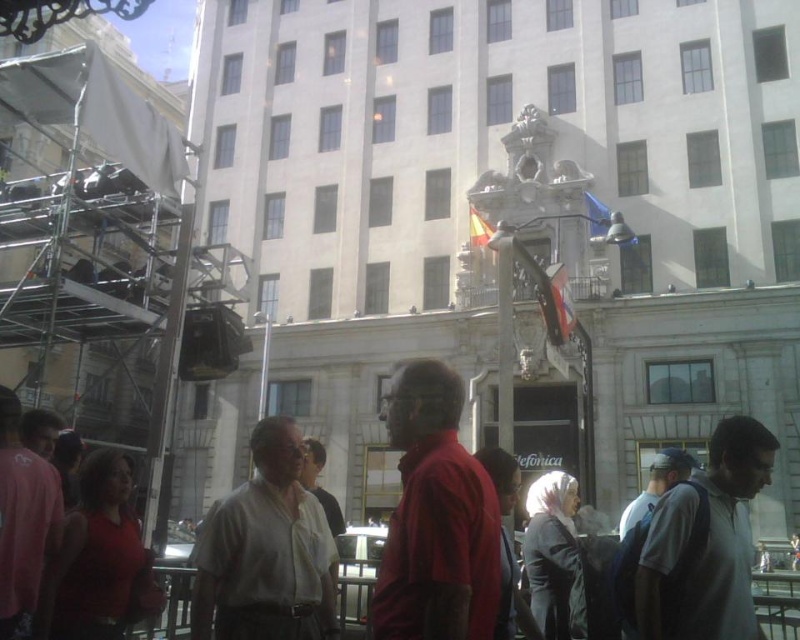
You are standing in front of a classical building with tourists around. You want to take a photo of the point marked at coordinate (454,572). Is this point within your camera frame if your camera has a focal length of 50mm and a sensor size of 24x36mm?

The point at coordinate (454,572) is 26.07 meters away from the camera. Using the camera specifications, the maximum distance for capturing that point within the frame can be calculated. However, since the distance is 26.07 meters, which is well within the camera range, the point should be visible in the frame.

You are a photographer trying to capture the matte red shirt at center and the light brown shirt at center in the same frame. Which of the two shirts should you focus on first if you want to ensure both are in focus?

The matte red shirt at center is above the light brown shirt at center, so focusing on the matte red shirt at center first will help ensure both are in focus as it is closer to the camera.